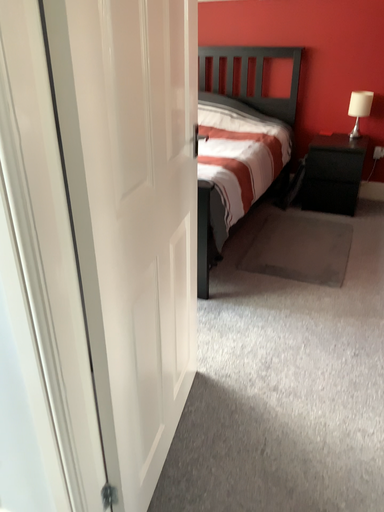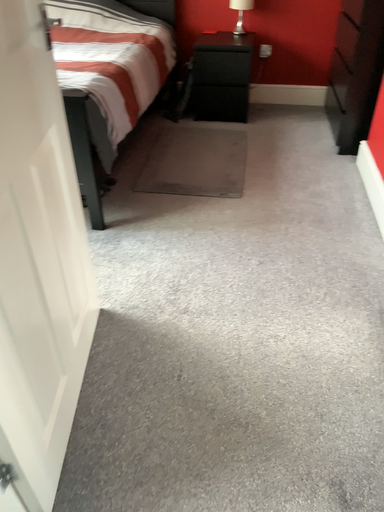
Question: How did the camera likely rotate when shooting the video?

Choices:
 (A) rotated downward
 (B) rotated upward

Answer: (A)